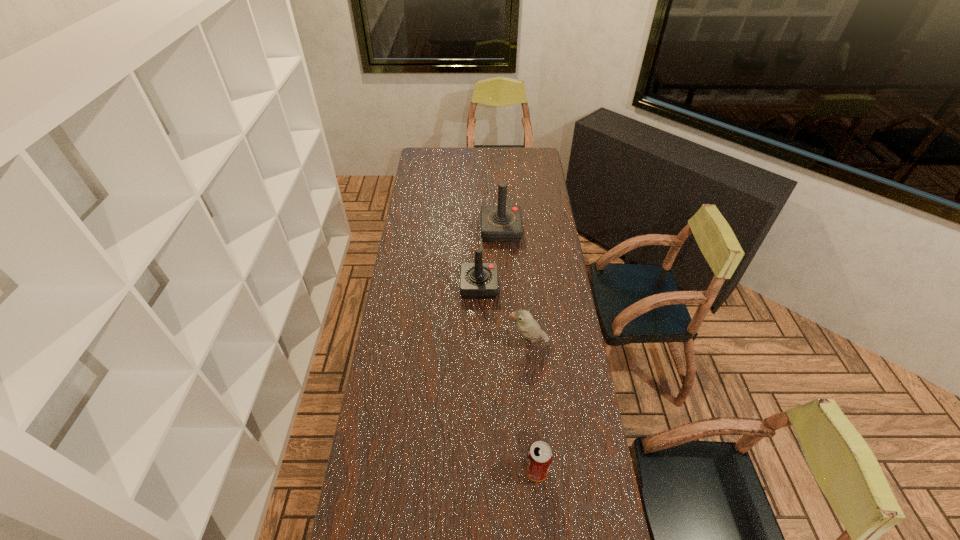
This screenshot has height=540, width=960. Identify the location of vacant space located on the front-facing side of the nearer joystick. (516, 287).

Where is `free region located 0.240m at the face of the third farthest object`? free region located 0.240m at the face of the third farthest object is located at coordinates (444, 343).

You are a GUI agent. You are given a task and a screenshot of the screen. Output one action in this format:
    pyautogui.click(x=<x>, y=<y>)
    Task: Click on the vacant space situated 0.350m at the face of the third farthest object
    
    Given the screenshot: What is the action you would take?
    pyautogui.click(x=417, y=343)

Locate an element on the screen. The height and width of the screenshot is (540, 960). free space located at the face of the third farthest object is located at coordinates (455, 343).

Where is `free space located 0.120m on the left of the nearest object`? free space located 0.120m on the left of the nearest object is located at coordinates (486, 470).

In order to click on object situated at the right edge in this screenshot , I will do `click(528, 327)`.

You are a GUI agent. You are given a task and a screenshot of the screen. Output one action in this format:
    pyautogui.click(x=<x>, y=<y>)
    Task: Click on the vacant space at the far edge of the desktop
    
    Given the screenshot: What is the action you would take?
    pyautogui.click(x=476, y=167)

The width and height of the screenshot is (960, 540). Find the location of `free space at the left edge of the desktop`. free space at the left edge of the desktop is located at coordinates (394, 407).

Where is `vacant space at the right edge of the desktop`? Image resolution: width=960 pixels, height=540 pixels. vacant space at the right edge of the desktop is located at coordinates (570, 444).

This screenshot has height=540, width=960. In the image, there is a desktop. What are the coordinates of `vacant region at the far right corner` in the screenshot? It's located at (525, 159).